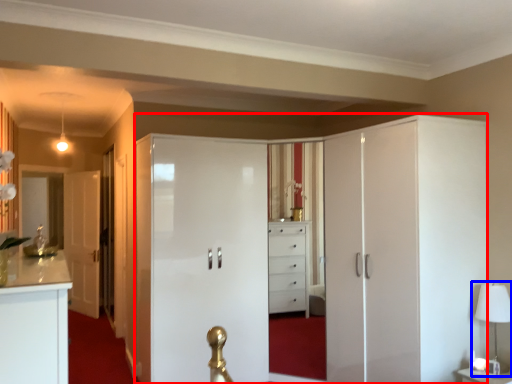
Question: Which of the following is the farthest to the observer, dresser (highlighted by a red box) or table lamp (highlighted by a blue box)?

Choices:
 (A) dresser
 (B) table lamp

Answer: (B)